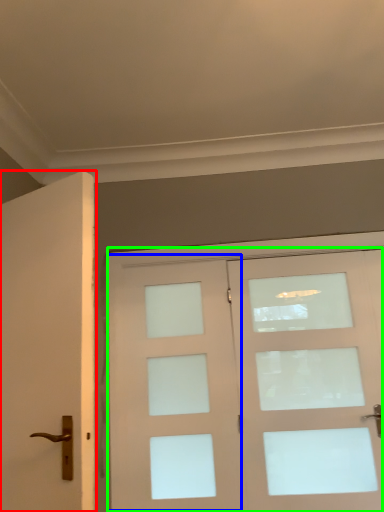
Question: Estimate the real-world distances between objects in this image. Which object is closer to door (highlighted by a red box), screen door (highlighted by a blue box) or door (highlighted by a green box)?

Choices:
 (A) screen door
 (B) door

Answer: (A)